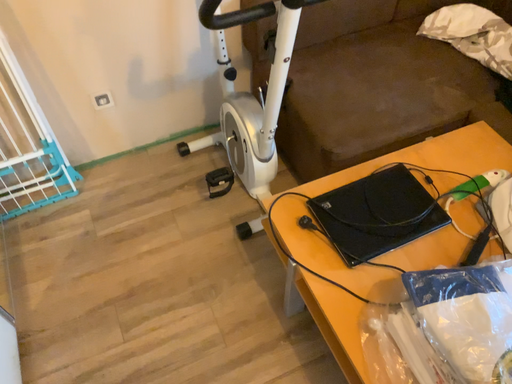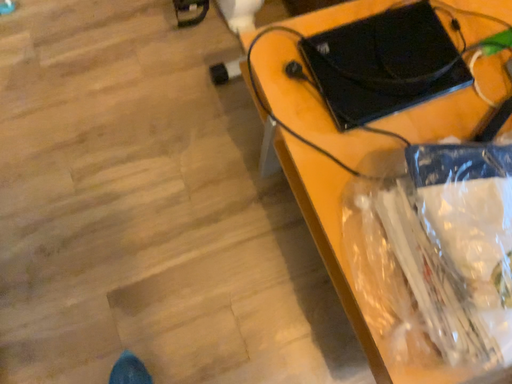
Question: Which way did the camera rotate in the video?

Choices:
 (A) rotated downward
 (B) rotated upward

Answer: (A)